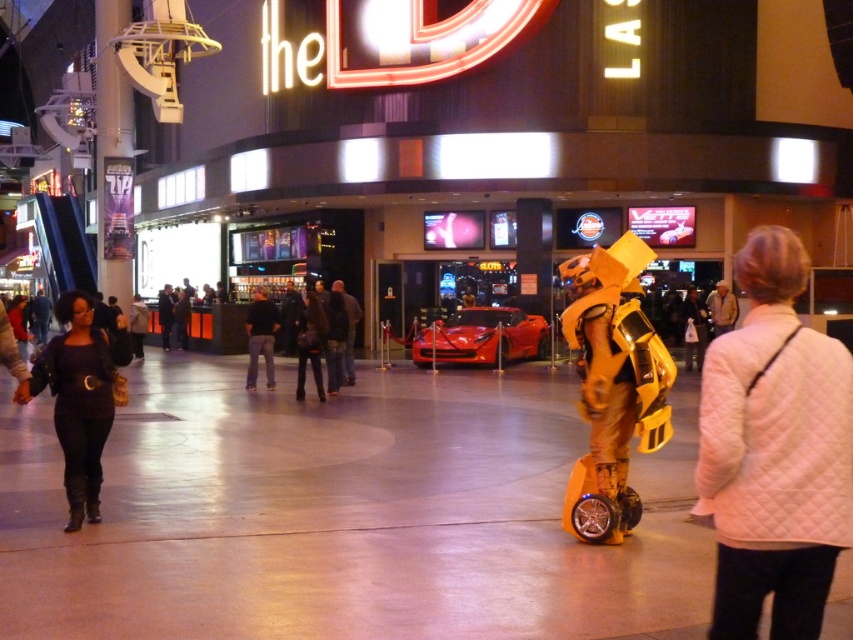
You are a photographer standing at the center of the scene. You want to take a photo of both the white quilted jacket at lower right and the black leather jacket at left. Can you fit both in your camera frame if your camera has a 10 meter field of view?

The white quilted jacket at lower right is 6.81 meters from the black leather jacket at left. Since the distance between them is less than the camera field of view of 10 meters, both can be captured in a single frame.

You are a photographer trying to capture both the white quilted jacket at lower right and the black leather jacket at center in a single frame. Based on their heights, which jacket will appear larger in the photo?

The black leather jacket at center will appear larger in the photo because it is taller than the white quilted jacket at lower right.